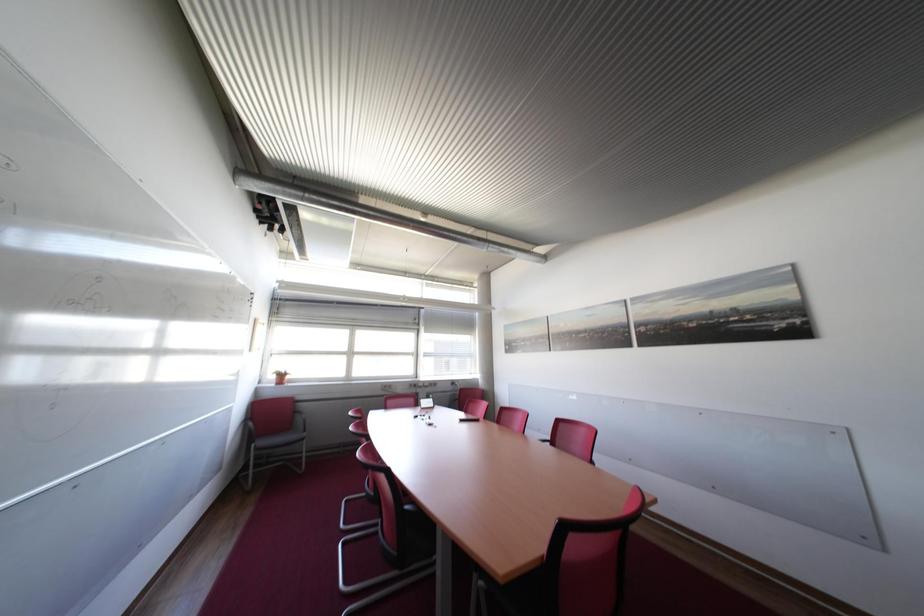
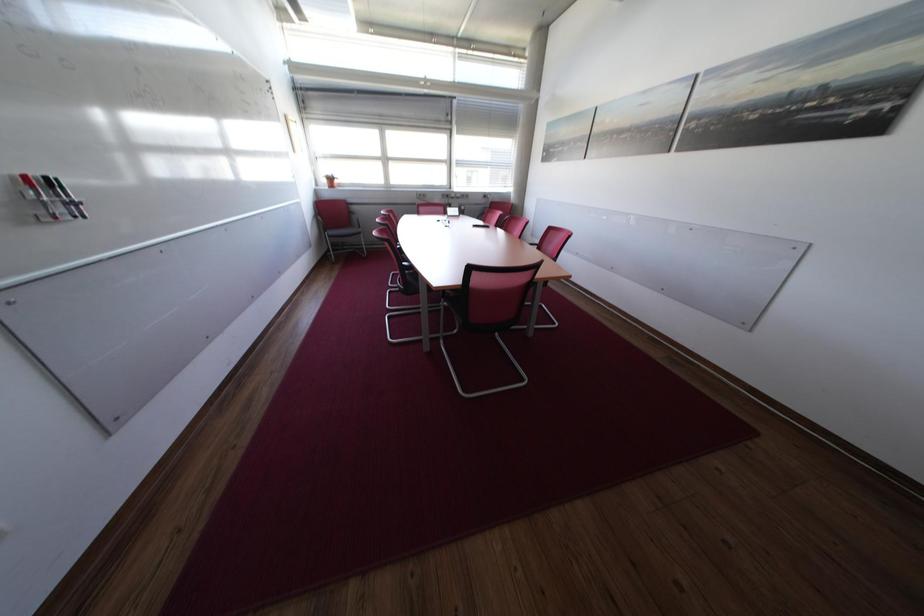
Question: The images are taken continuously from a first-person perspective. In which direction is your viewpoint rotating?

Choices:
 (A) Left
 (B) Right
 (C) Up
 (D) Down

Answer: (D)